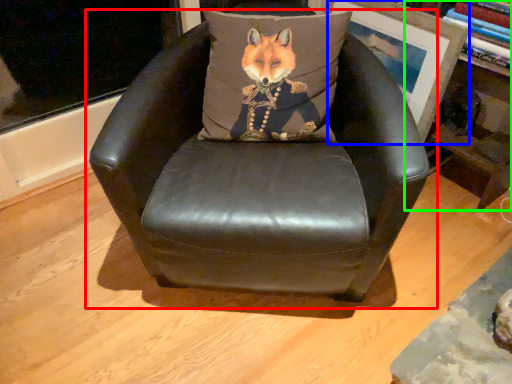
Question: Which is farther away from chair (highlighted by a red box)? picture frame (highlighted by a blue box) or bookshelf (highlighted by a green box)?

Choices:
 (A) picture frame
 (B) bookshelf

Answer: (B)